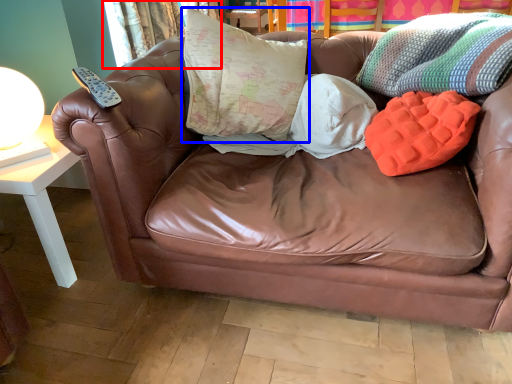
Question: Among these objects, which one is nearest to the camera, curtain (highlighted by a red box) or pillow (highlighted by a blue box)?

Choices:
 (A) curtain
 (B) pillow

Answer: (B)